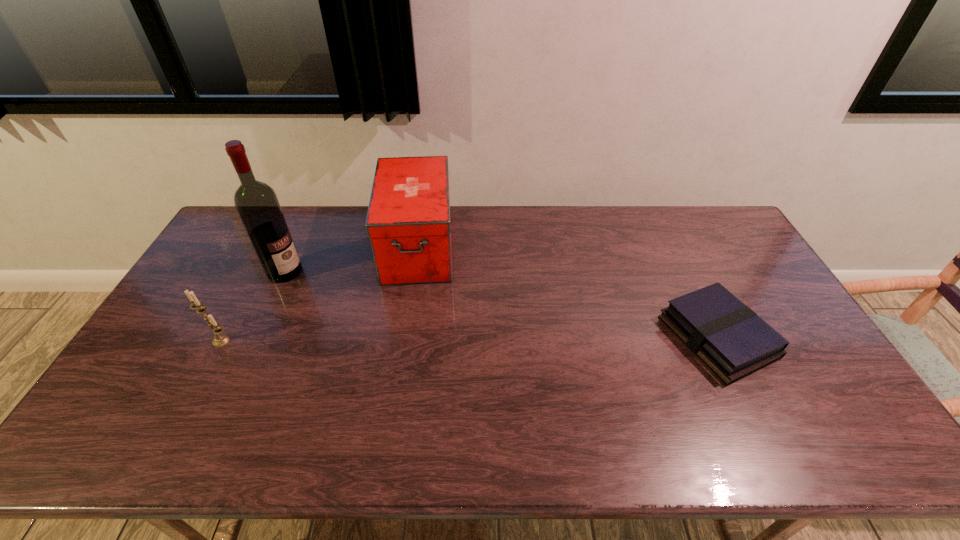
Locate an element on the screen. The width and height of the screenshot is (960, 540). vacant area at the near edge of the desktop is located at coordinates (256, 413).

In the image, there is a desktop. Where is `vacant space at the left edge`? The height and width of the screenshot is (540, 960). vacant space at the left edge is located at coordinates (222, 314).

The width and height of the screenshot is (960, 540). In the image, there is a desktop. In order to click on free space at the far right corner in this screenshot , I will do `click(728, 220)`.

The width and height of the screenshot is (960, 540). Find the location of `free point between the tallest object and the shortest object`. free point between the tallest object and the shortest object is located at coordinates (501, 304).

Find the location of a particular element. This screenshot has width=960, height=540. free space between the tallest object and the first-aid kit is located at coordinates (351, 259).

Where is `free point between the alcohol and the shortest object`? This screenshot has height=540, width=960. free point between the alcohol and the shortest object is located at coordinates (501, 304).

Find the location of a particular element. Image resolution: width=960 pixels, height=540 pixels. empty location between the second shortest object and the book is located at coordinates (469, 339).

You are a GUI agent. You are given a task and a screenshot of the screen. Output one action in this format:
    pyautogui.click(x=<x>, y=<y>)
    Task: Click on the free space between the alcohol and the rightmost object
    The height and width of the screenshot is (540, 960).
    Given the screenshot: What is the action you would take?
    pyautogui.click(x=501, y=304)

Identify the location of vacant space that's between the rightmost object and the alcohol. (501, 304).

You are a GUI agent. You are given a task and a screenshot of the screen. Output one action in this format:
    pyautogui.click(x=<x>, y=<y>)
    Task: Click on the free spot between the second shortest object and the first-aid kit
    The width and height of the screenshot is (960, 540).
    Given the screenshot: What is the action you would take?
    pyautogui.click(x=320, y=294)